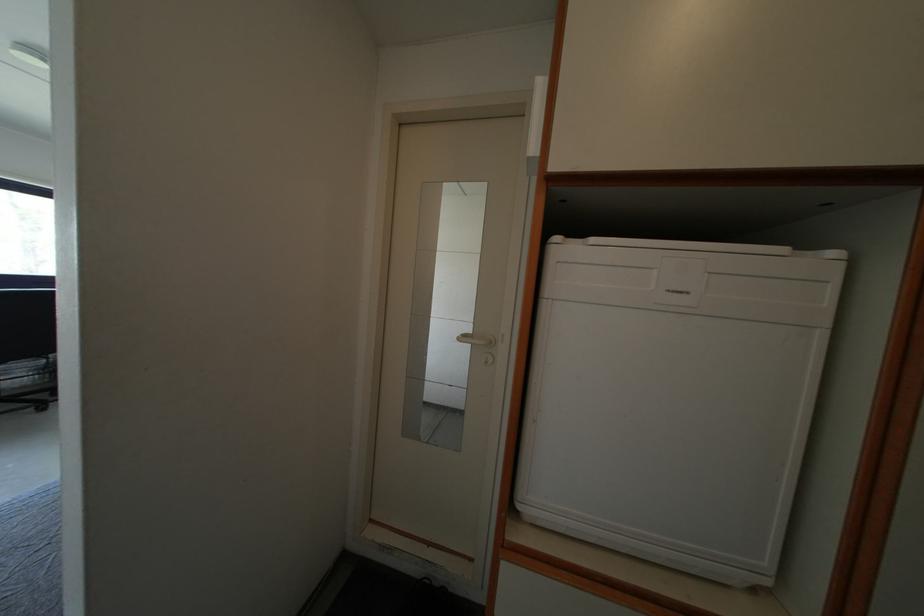
Where is `white door handle`? Image resolution: width=924 pixels, height=616 pixels. white door handle is located at coordinates (476, 339).